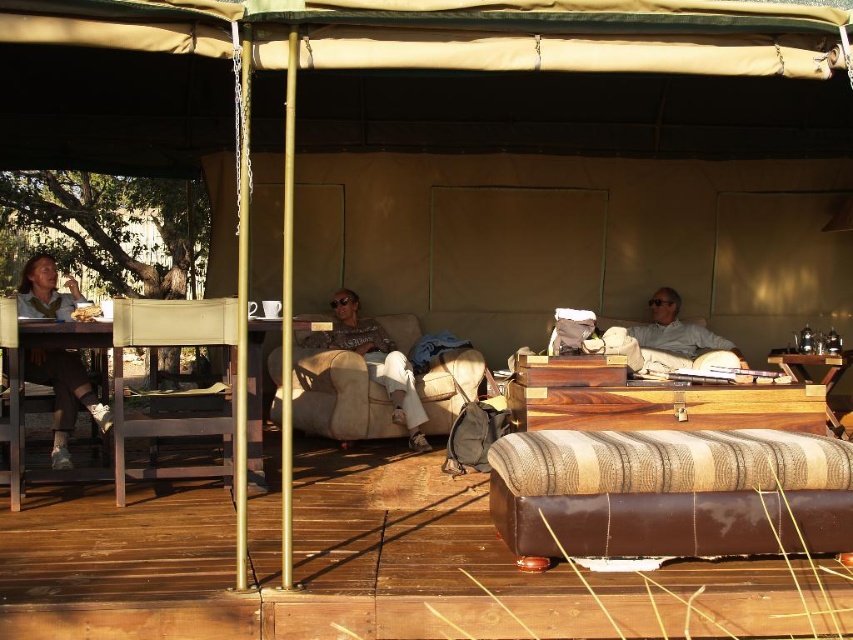
Is point (442, 428) positioned after point (694, 342)?

No, it is in front of (694, 342).

Who is shorter, beige fabric armchair at center or light gray fabric couch at right?

light gray fabric couch at right is shorter.

This screenshot has height=640, width=853. I want to click on beige fabric armchair at center, so click(337, 394).

Which is more to the right, metallic silver armchair at left or matte black jacket at left?

metallic silver armchair at left

Which is in front, point (160, 424) or point (39, 275)?

Point (160, 424)

Is point (152, 326) positioned before point (48, 352)?

Yes.

What are the coordinates of `metallic silver armchair at left` in the screenshot? It's located at (173, 346).

Is point (445, 360) farther from camera compared to point (258, 433)?

That is True.

The width and height of the screenshot is (853, 640). I want to click on beige fabric armchair at center, so click(x=337, y=394).

Identify the location of beige fabric armchair at center. Image resolution: width=853 pixels, height=640 pixels. pyautogui.click(x=337, y=394).